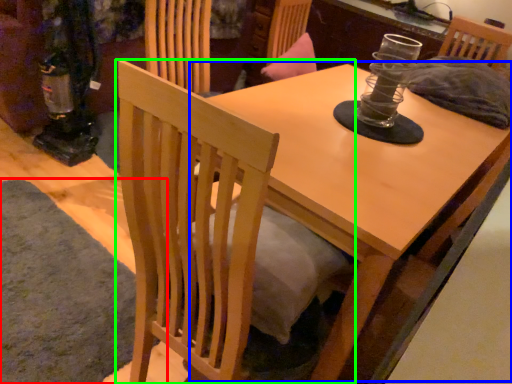
Question: Based on their relative distances, which object is nearer to mat (highlighted by a red box)? Choose from round table (highlighted by a blue box) and chair (highlighted by a green box).

Choices:
 (A) round table
 (B) chair

Answer: (B)